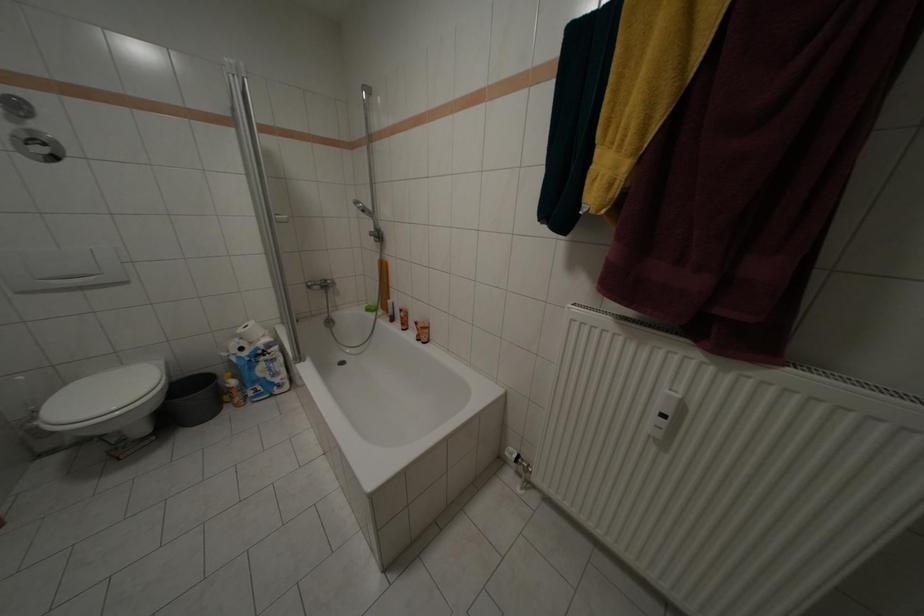
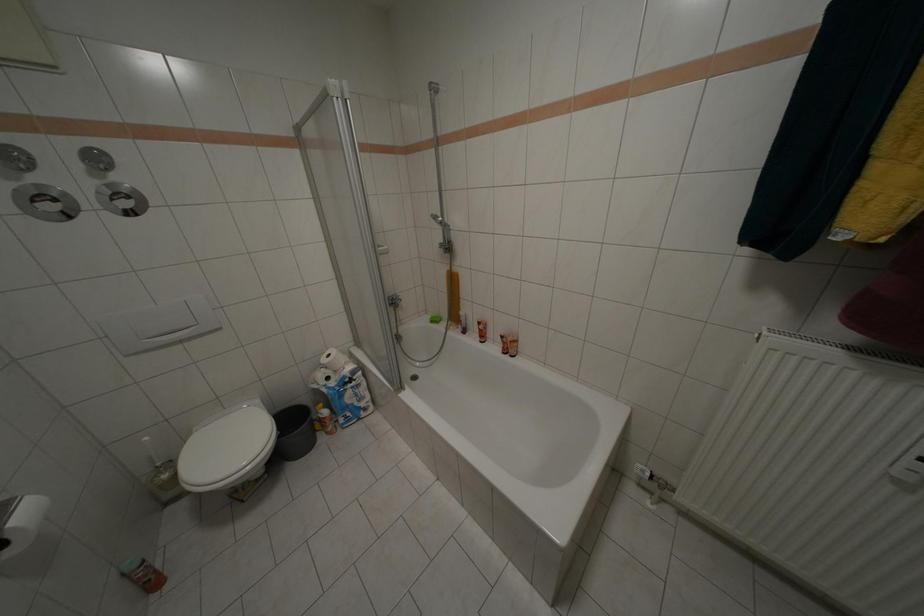
Question: Based on the continuous images, in which direction is the camera rotating? Reply with the corresponding letter.

Choices:
 (A) Left
 (B) Right
 (C) Up
 (D) Down

Answer: (D)